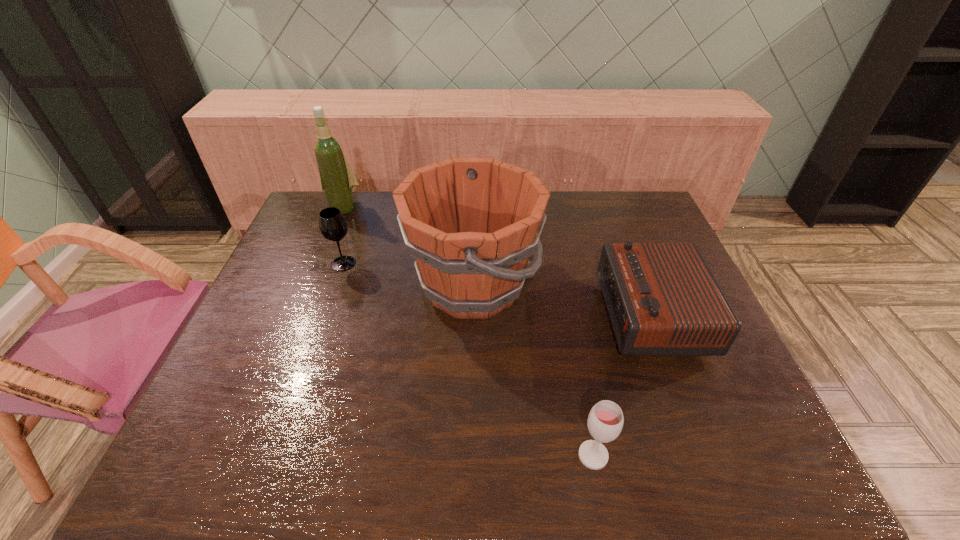
The image size is (960, 540). I want to click on object present at the far left corner, so click(337, 179).

Find the location of a particular element. Image resolution: width=960 pixels, height=540 pixels. vacant region at the far edge of the desktop is located at coordinates (573, 195).

Locate an element on the screen. free space at the near edge is located at coordinates (290, 458).

Find the location of a particular element. Image resolution: width=960 pixels, height=540 pixels. vacant space at the left edge of the desktop is located at coordinates click(x=246, y=360).

The width and height of the screenshot is (960, 540). Find the location of `free space at the right edge of the desktop`. free space at the right edge of the desktop is located at coordinates (629, 240).

In order to click on unoccupied position between the left wineglass and the bucket in this screenshot , I will do `click(408, 274)`.

Image resolution: width=960 pixels, height=540 pixels. In order to click on empty location between the fourth shortest object and the left wineglass in this screenshot , I will do `click(408, 274)`.

What are the coordinates of `vacant space that's between the right wineglass and the farthest object` in the screenshot? It's located at (468, 332).

This screenshot has height=540, width=960. Identify the location of free point between the bucket and the left wineglass. (408, 274).

Find the location of a particular element. This screenshot has height=540, width=960. free space between the bucket and the radio receiver is located at coordinates (562, 301).